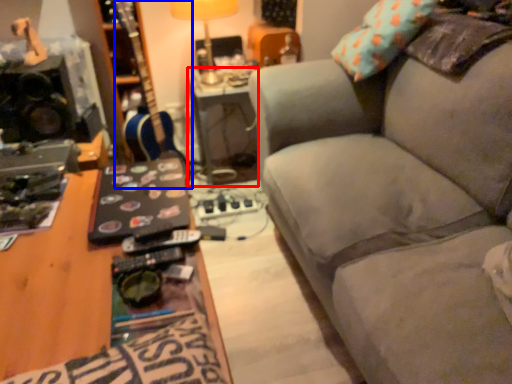
Question: Which object is further to the camera taking this photo, table (highlighted by a red box) or guitar (highlighted by a blue box)?

Choices:
 (A) table
 (B) guitar

Answer: (A)